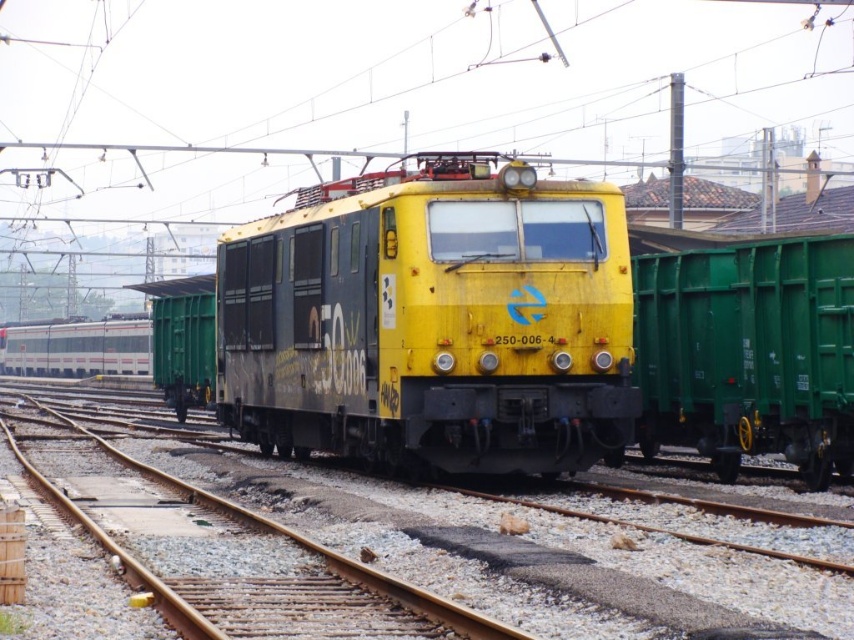
This screenshot has height=640, width=854. What do you see at coordinates (522, 330) in the screenshot?
I see `yellow matte train at center` at bounding box center [522, 330].

What are the coordinates of `yellow matte train at center` in the screenshot? It's located at (522, 330).